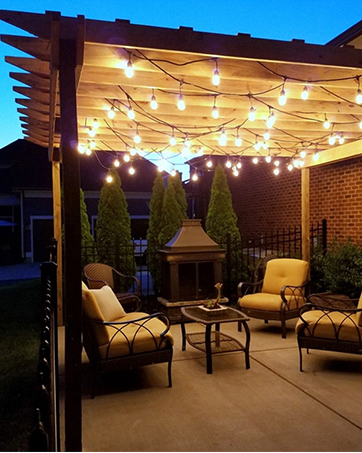
Where is `cushion`? This screenshot has height=453, width=362. cushion is located at coordinates (104, 298), (128, 328), (263, 300), (278, 275), (323, 328), (360, 307).